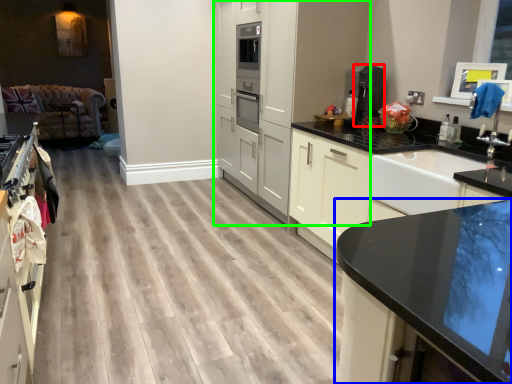
Question: Which object is the farthest from coffee machine (highlighted by a red box)? Choose among these: countertop (highlighted by a blue box) or cabinetry (highlighted by a green box).

Choices:
 (A) countertop
 (B) cabinetry

Answer: (A)